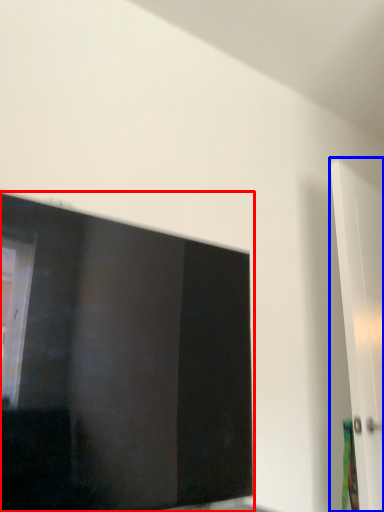
Question: Which point is closer to the camera, window (highlighted by a red box) or door (highlighted by a blue box)?

Choices:
 (A) window
 (B) door

Answer: (A)